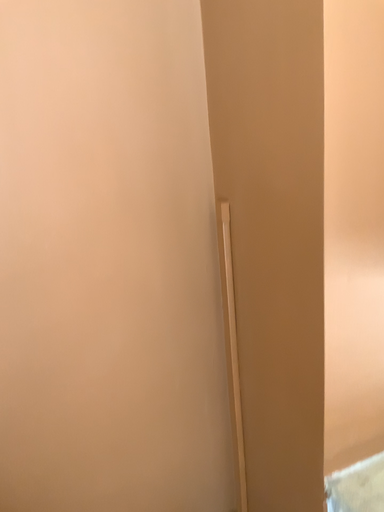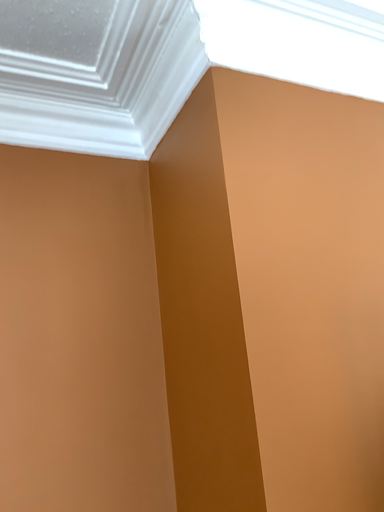
Question: How did the camera likely rotate when shooting the video?

Choices:
 (A) rotated downward
 (B) rotated upward

Answer: (B)